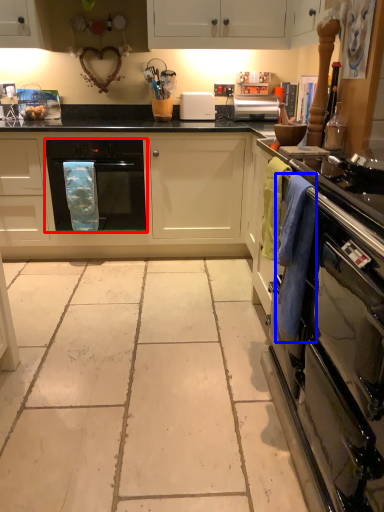
Question: Which object is closer to the camera taking this photo, home appliance (highlighted by a red box) or laundry (highlighted by a blue box)?

Choices:
 (A) home appliance
 (B) laundry

Answer: (B)